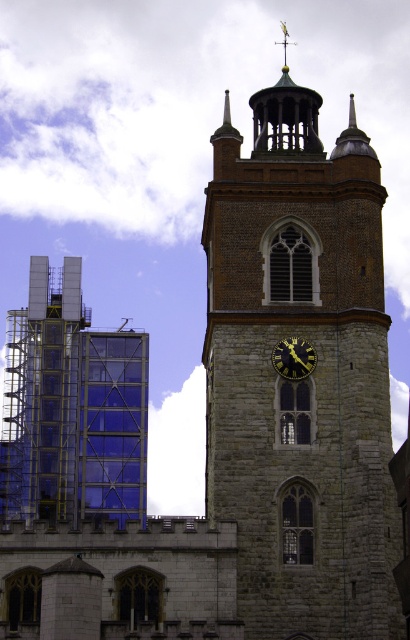
Image resolution: width=410 pixels, height=640 pixels. What do you see at coordinates (302, 378) in the screenshot?
I see `stone clock tower at center` at bounding box center [302, 378].

Which is behind, point (259, 288) or point (305, 355)?

Positioned behind is point (259, 288).

You are a GUI agent. You are given a task and a screenshot of the screen. Output one action in this format:
    pyautogui.click(x=<x>, y=<y>)
    Task: Click on the stone clock tower at center
    This screenshot has width=410, height=640.
    Given the screenshot: What is the action you would take?
    pyautogui.click(x=302, y=378)

Can you confirm if stone clock tower at center is shorter than transparent glass building at left?

Incorrect, stone clock tower at center's height does not fall short of transparent glass building at left's.

Is point (266, 204) positioned in front of point (95, 413)?

Yes, point (266, 204) is closer to viewer.

Where is `stone clock tower at center`? stone clock tower at center is located at coordinates (302, 378).

Which of these two, transparent glass building at left or gold metallic clock at center, stands taller?

With more height is transparent glass building at left.

Between transparent glass building at left and gold metallic clock at center, which one has less height?

With less height is gold metallic clock at center.

Identify the location of transparent glass building at left. This screenshot has width=410, height=640. (72, 406).

Locate an element on the screen. transparent glass building at left is located at coordinates (72, 406).